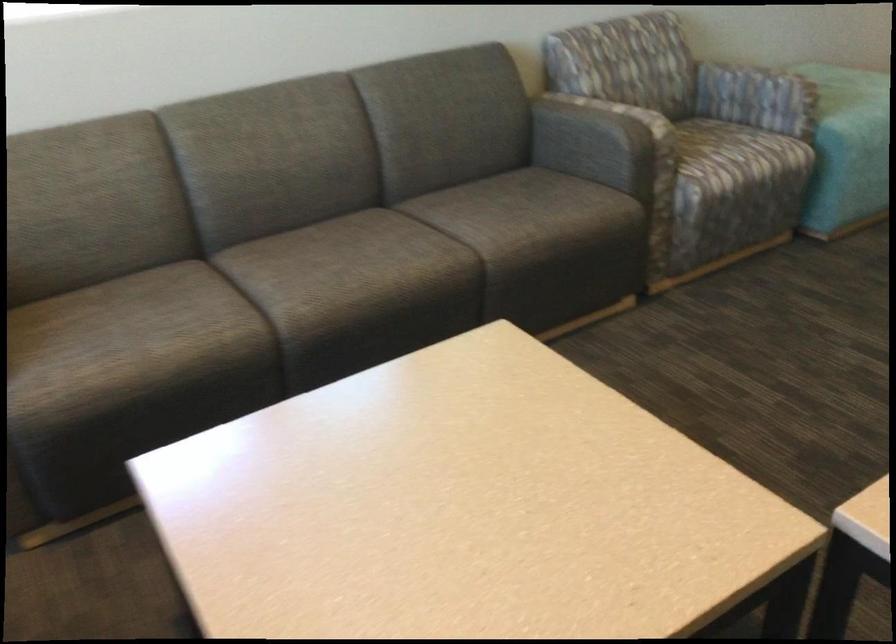
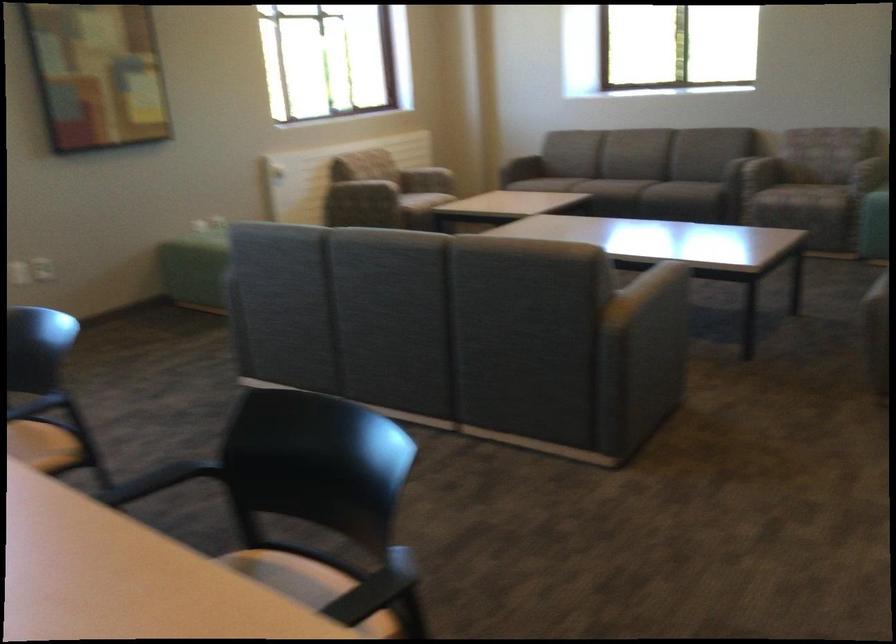
Locate, in the second image, the point that corresponds to [128,333] in the first image.

(522, 167)